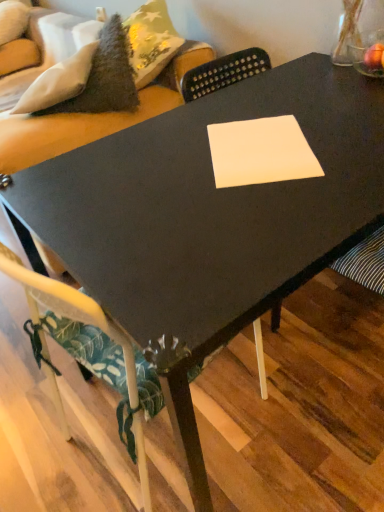
Question: In terms of height, does velvet green couch at upper left look taller or shorter compared to white fabric chair at lower left?

Choices:
 (A) short
 (B) tall

Answer: (B)

Question: Is point (170, 96) positioned closer to the camera than point (56, 295)?

Choices:
 (A) farther
 (B) closer

Answer: (A)

Question: Considering the real-world distances, which object is closest to the white paper at center?

Choices:
 (A) velvet green couch at upper left
 (B) white fabric chair at lower left

Answer: (B)

Question: Considering the real-world distances, which object is closest to the white fabric chair at lower left?

Choices:
 (A) white paper at center
 (B) velvet green couch at upper left

Answer: (A)